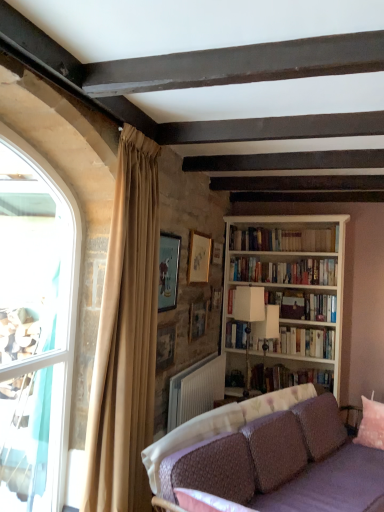
This screenshot has height=512, width=384. Describe the element at coordinates (290, 290) in the screenshot. I see `white wooden bookcase at right` at that location.

What do you see at coordinates (285, 271) in the screenshot?
I see `hardcover books at center, acting as the 2th book starting from the top` at bounding box center [285, 271].

This screenshot has height=512, width=384. What do you see at coordinates (217, 253) in the screenshot?
I see `wooden picture frame at upper center, which is counted as the 1th picture frame, starting from the back` at bounding box center [217, 253].

How much space does matte wooden picture frame at upper center, the fifth picture frame in the back-to-front sequence, occupy vertically?

21.41 inches.

In order to face wooden picture frame at center, the 4th picture frame viewed from the front, should I rotate leftwards or rightwards?

Rotate your view right by about 0.957°.

Image resolution: width=384 pixels, height=512 pixels. What do you see at coordinates (327, 460) in the screenshot?
I see `purple fabric couch at lower right` at bounding box center [327, 460].

Find the location of a particular element. The width and height of the screenshot is (384, 512). matte gold picture frame at upper center, positioned as the third picture frame in front-to-back order is located at coordinates (198, 257).

What is the approximate height of matte gold picture frame at upper center, positioned as the third picture frame in front-to-back order?

It is 45.10 centimeters.

Identify the location of white wooden bookcase at right. The height and width of the screenshot is (512, 384). (290, 290).

Identify the location of curtain in front of the white fabric lampshade at center, marked as the second lamp in a front-to-back arrangement. The height and width of the screenshot is (512, 384). (126, 338).

Is beige velvet curtain at left taller than white fabric lampshade at center, marked as the second lamp in a front-to-back arrangement?

Yes, beige velvet curtain at left is taller than white fabric lampshade at center, marked as the second lamp in a front-to-back arrangement.

Would you say beige velvet curtain at left is inside or outside white fabric lampshade at center, which is the 1th lamp in back-to-front order?

beige velvet curtain at left is located beyond the bounds of white fabric lampshade at center, which is the 1th lamp in back-to-front order.

Is point (110, 490) more distant than point (260, 325)?

No, (110, 490) is closer to viewer.

Which is in front, point (377, 409) or point (264, 346)?

The point (377, 409) is closer to the camera.

Looking at this image, from the image's perspective, does pink fabric pillow at lower right appear lower than white fabric lampshade at center, which is the 1th lamp in back-to-front order?

Yes, from the image's perspective, pink fabric pillow at lower right is beneath white fabric lampshade at center, which is the 1th lamp in back-to-front order.

Consider the image. From a real-world perspective, is pink fabric pillow at lower right positioned above or below white fabric lampshade at center, which is the 1th lamp in back-to-front order?

From a real-world perspective, pink fabric pillow at lower right is physically below white fabric lampshade at center, which is the 1th lamp in back-to-front order.

In the image, is pink fabric pillow at lower right on the left side or the right side of white fabric lampshade at center, marked as the second lamp in a front-to-back arrangement?

pink fabric pillow at lower right is to the right of white fabric lampshade at center, marked as the second lamp in a front-to-back arrangement.

Considering the sizes of objects wooden picture frame at upper center, the 2th picture frame from the front, and wooden picture frame at upper center, the 5th picture frame from the front, in the image provided, who is taller, wooden picture frame at upper center, the 2th picture frame from the front, or wooden picture frame at upper center, the 5th picture frame from the front,?

wooden picture frame at upper center, the 2th picture frame from the front, is taller.

Considering the sizes of wooden picture frame at upper center, which is counted as the fourth picture frame, starting from the back, and wooden picture frame at upper center, which is counted as the 1th picture frame, starting from the back, in the image, is wooden picture frame at upper center, which is counted as the fourth picture frame, starting from the back, bigger or smaller than wooden picture frame at upper center, which is counted as the 1th picture frame, starting from the back,?

In the image, wooden picture frame at upper center, which is counted as the fourth picture frame, starting from the back, appears to be larger than wooden picture frame at upper center, which is counted as the 1th picture frame, starting from the back.

How many degrees apart are the facing directions of wooden picture frame at upper center, the 2th picture frame from the front, and wooden picture frame at upper center, which is counted as the 1th picture frame, starting from the back?

0.25 degrees separate the facing orientations of wooden picture frame at upper center, the 2th picture frame from the front, and wooden picture frame at upper center, which is counted as the 1th picture frame, starting from the back.

Looking at this image, is wooden picture frame at center, the 4th picture frame viewed from the front, wider than beige velvet curtain at left?

Incorrect, the width of wooden picture frame at center, the 4th picture frame viewed from the front, does not surpass that of beige velvet curtain at left.

In the image, is wooden picture frame at center, the 4th picture frame viewed from the front, positioned in front of or behind beige velvet curtain at left?

wooden picture frame at center, the 4th picture frame viewed from the front, is behind beige velvet curtain at left.

From a real-world perspective, is wooden picture frame at center, the 2th picture frame from the back, below beige velvet curtain at left?

Correct, in the physical world, wooden picture frame at center, the 2th picture frame from the back, is lower than beige velvet curtain at left.

The image size is (384, 512). What are the coordinates of `picture frame that is the 3rd object to the right of the beige velvet curtain at left, starting at the anchor` in the screenshot? It's located at (197, 320).

Considering the points (296, 498) and (125, 202), which point is behind, point (296, 498) or point (125, 202)?

The point (296, 498) is more distant.

From the picture: Does purple fabric couch at lower right appear on the right side of beige velvet curtain at left?

Indeed, purple fabric couch at lower right is positioned on the right side of beige velvet curtain at left.

Measure the distance from purple fabric couch at lower right to beige velvet curtain at left.

purple fabric couch at lower right is 31.22 inches from beige velvet curtain at left.

From a real-world perspective, which is physically above, purple fabric couch at lower right or beige velvet curtain at left?

beige velvet curtain at left.

Who is smaller, white matte bookshelf at center, the second book when ordered from bottom to top, or hardcover books at center, acting as the 2th book starting from the top?

hardcover books at center, acting as the 2th book starting from the top.

Can you tell me how much white matte bookshelf at center, which appears as the third book when viewed from the top, and hardcover books at center, which is counted as the third book, starting from the bottom, differ in facing direction?

white matte bookshelf at center, which appears as the third book when viewed from the top, and hardcover books at center, which is counted as the third book, starting from the bottom, are facing 0.251 degrees away from each other.

Is white matte bookshelf at center, which appears as the third book when viewed from the top, closer to camera compared to hardcover books at center, which is counted as the third book, starting from the bottom?

Yes, it is.

From the picture: Is white matte bookshelf at center, the second book when ordered from bottom to top, far away from hardcover books at center, acting as the 2th book starting from the top?

No, white matte bookshelf at center, the second book when ordered from bottom to top, is not far from hardcover books at center, acting as the 2th book starting from the top.

Is wooden bookshelf at upper right, the 4th book ordered from the bottom, closer to camera compared to wooden picture frame at center, the 4th picture frame viewed from the front?

No, wooden bookshelf at upper right, the 4th book ordered from the bottom, is further to the viewer.

This screenshot has width=384, height=512. Find the location of `the 2nd picture frame in front of the wooden bookshelf at upper right, which ranks as the first book in top-to-bottom order`. the 2nd picture frame in front of the wooden bookshelf at upper right, which ranks as the first book in top-to-bottom order is located at coordinates (197, 320).

Looking at this image, from a real-world perspective, which object stands above the other?

In real-world perspective, wooden bookshelf at upper right, which ranks as the first book in top-to-bottom order, is above.

Identify the location of curtain in front of the white fabric lampshade at center, marked as the second lamp in a front-to-back arrangement. This screenshot has height=512, width=384. (126, 338).

Find the location of a particular element. the 1st lamp located above the pink fabric pillow at lower right (from a real-world perspective) is located at coordinates (267, 328).

Estimate the real-world distances between objects in this image. Which object is further from white plastic radiator at lower center, white matte lamp at center, which is the second lamp in back-to-front order, or wooden bookshelf at upper right, the 4th book ordered from the bottom?

Based on the image, wooden bookshelf at upper right, the 4th book ordered from the bottom, appears to be further to white plastic radiator at lower center.

Based on their spatial positions, is matte gold picture frame at upper center, which appears as the 3th picture frame when viewed from the back, or white matte bookshelf at center, the second book when ordered from bottom to top, closer to wooden picture frame at upper center, which is counted as the fourth picture frame, starting from the back?

Based on the image, matte gold picture frame at upper center, which appears as the 3th picture frame when viewed from the back, appears to be nearer to wooden picture frame at upper center, which is counted as the fourth picture frame, starting from the back.

Considering their positions, is pink fabric pillow at lower right positioned closer to white plastic radiator at lower center than wooden picture frame at upper center, which is counted as the fourth picture frame, starting from the back?

The object closer to white plastic radiator at lower center is wooden picture frame at upper center, which is counted as the fourth picture frame, starting from the back.

When comparing their distances from white matte bookshelf at center, which appears as the third book when viewed from the top, does white plastic radiator at lower center or hardcover books at center, acting as the 2th book starting from the top, seem closer?

The object closer to white matte bookshelf at center, which appears as the third book when viewed from the top, is hardcover books at center, acting as the 2th book starting from the top.

From the image, which object appears to be nearer to white plastic radiator at lower center, matte gold picture frame at upper center, positioned as the third picture frame in front-to-back order, or wooden picture frame at upper center, which is counted as the 1th picture frame, starting from the back?

matte gold picture frame at upper center, positioned as the third picture frame in front-to-back order, is closer to white plastic radiator at lower center.

Looking at the image, which one is located closer to clear glass window at left, wooden picture frame at upper center, the 2th picture frame from the front, or white fabric lampshade at center, which is the 1th lamp in back-to-front order?

wooden picture frame at upper center, the 2th picture frame from the front, is closer to clear glass window at left.

Based on the photo, which object lies nearer to the anchor point wooden bookshelf at upper right, the 4th book ordered from the bottom, wooden picture frame at center, the 4th picture frame viewed from the front, or white wooden bookcase at right?

Based on the image, white wooden bookcase at right appears to be nearer to wooden bookshelf at upper right, the 4th book ordered from the bottom.

Based on their spatial positions, is beige velvet curtain at left or wooden picture frame at upper center, which is counted as the fourth picture frame, starting from the back, closer to white matte bookshelf at center, the second book when ordered from bottom to top?

wooden picture frame at upper center, which is counted as the fourth picture frame, starting from the back, is positioned closer to the anchor white matte bookshelf at center, the second book when ordered from bottom to top.

Locate an element on the screen. The image size is (384, 512). bookcase between wooden picture frame at upper center, which is counted as the 1th picture frame, starting from the back, and white matte bookshelf at center, the second book when ordered from bottom to top, vertically is located at coordinates (290, 290).

Locate an element on the screen. Image resolution: width=384 pixels, height=512 pixels. pillow between purple fabric couch at lower right and white wooden bookcase at right from front to back is located at coordinates (371, 424).

What are the coordinates of `picture frame between matte gold picture frame at upper center, which appears as the 3th picture frame when viewed from the back, and wooden bookshelf at upper right, the 4th book ordered from the bottom` in the screenshot? It's located at (217, 253).

What are the coordinates of `bookcase situated between white plastic radiator at lower center and pink fabric pillow at lower right from left to right` in the screenshot? It's located at (290, 290).